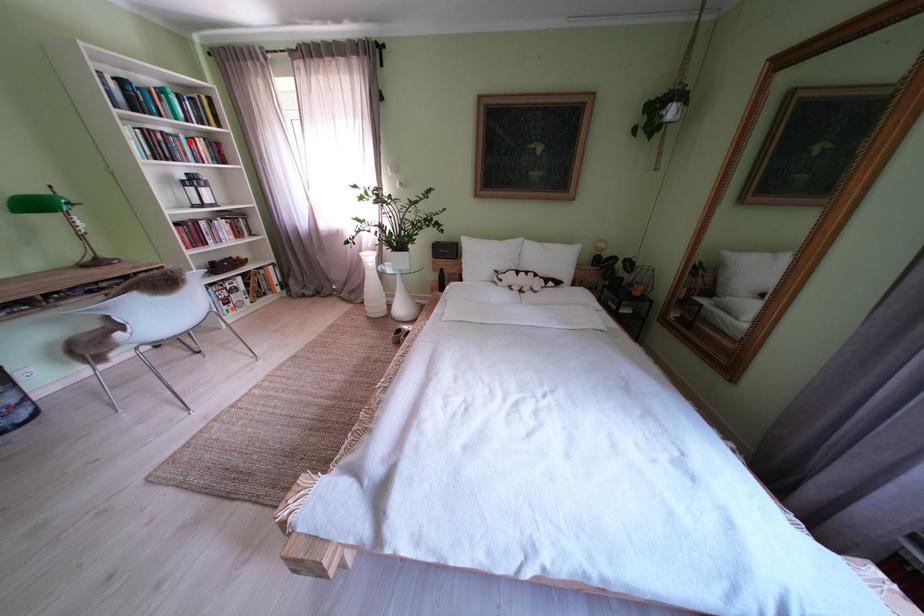
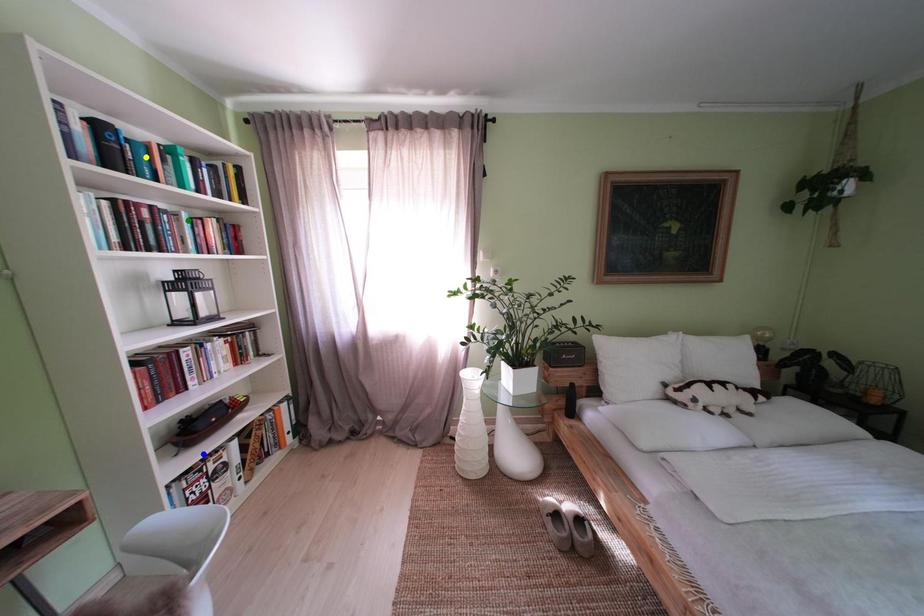
Question: I am providing you with two images of the same scene from different viewpoints. A red point is marked on the first image. You are given multiple points on the second image. Which point in image 2 is actually the same real-world point as the red point in image 1?

Choices:
 (A) blue point
 (B) green point
 (C) yellow point

Answer: (B)